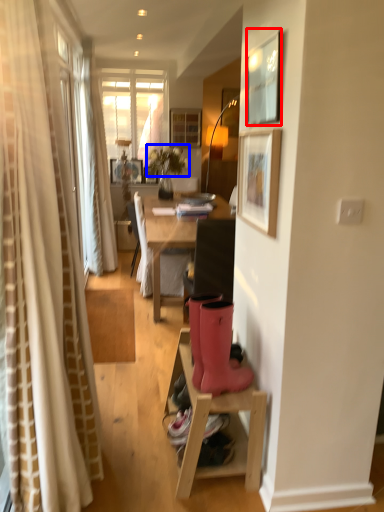
Question: Which object is further to the camera taking this photo, picture frame (highlighted by a red box) or flower (highlighted by a blue box)?

Choices:
 (A) picture frame
 (B) flower

Answer: (B)